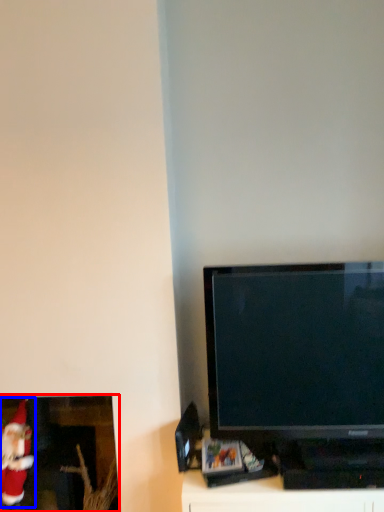
Question: Which point is closer to the camera, picture frame (highlighted by a red box) or santa claus (highlighted by a blue box)?

Choices:
 (A) picture frame
 (B) santa claus

Answer: (B)